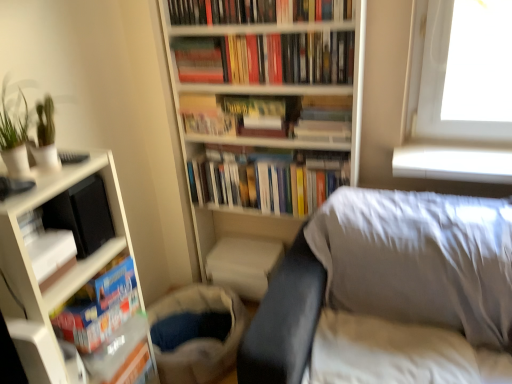
Measure the distance between hardcover books at center, which is the 5th book in bottom-to-top order, and camera.

The distance of hardcover books at center, which is the 5th book in bottom-to-top order, from camera is 5.17 feet.

Locate an element on the screen. This screenshot has width=512, height=384. hardcover book at center, which is counted as the second paperback book, starting from the right is located at coordinates (x=206, y=115).

How much space does matte brown book at center, which is the 1th paperback book from right to left, occupy horizontally?

matte brown book at center, which is the 1th paperback book from right to left, is 6.89 inches in width.

Measure the distance between point (46, 231) and camera.

→ Point (46, 231) is 4.10 feet away from camera.

What do you see at coordinates (388, 352) in the screenshot? I see `white fabric sheet at lower right` at bounding box center [388, 352].

Find the location of `matte gray bed at center`. matte gray bed at center is located at coordinates (386, 274).

Describe the element at coordinates (386, 274) in the screenshot. I see `matte gray bed at center` at that location.

Describe the element at coordinates (264, 182) in the screenshot. This screenshot has width=512, height=384. I see `hardcover books at center, the 5th book in the top-to-bottom sequence` at that location.

Where is `hardcover books at center, which is the 5th book in bottom-to-top order`? hardcover books at center, which is the 5th book in bottom-to-top order is located at coordinates (267, 58).

Is matte gray bed at center positioned beyond the bounds of hardcover books at center, the 5th book in the top-to-bottom sequence?

Yes.

Is matte gray bed at center not near hardcover books at center, the 5th book in the top-to-bottom sequence?

No, there isn't a large distance between matte gray bed at center and hardcover books at center, the 5th book in the top-to-bottom sequence.

From the image's perspective, relative to hardcover books at center, placed as the third book when sorted from bottom to top, is matte gray bed at center above or below?

Based on their image positions, matte gray bed at center is located beneath hardcover books at center, placed as the third book when sorted from bottom to top.

Can you confirm if matte gray bed at center is thinner than hardcover books at center, placed as the third book when sorted from bottom to top?

Incorrect, the width of matte gray bed at center is not less than that of hardcover books at center, placed as the third book when sorted from bottom to top.

Based on the photo, can you confirm if textured fabric bag at lower center is wider than white matte bookcase at center, which ranks as the 1th bookcase in right-to-left order?

Yes, textured fabric bag at lower center is wider than white matte bookcase at center, which ranks as the 1th bookcase in right-to-left order.

Who is smaller, textured fabric bag at lower center or white matte bookcase at center, which ranks as the 1th bookcase in right-to-left order?

textured fabric bag at lower center.

Who is more distant, textured fabric bag at lower center or white matte bookcase at center, which ranks as the 1th bookcase in right-to-left order?

textured fabric bag at lower center.

From the image's perspective, does hardcover books at center, acting as the 3th book starting from the top, appear higher than matte gray bed at center?

Yes, from the image's perspective, hardcover books at center, acting as the 3th book starting from the top, is above matte gray bed at center.

Can you tell me how much hardcover books at center, acting as the 3th book starting from the top, and matte gray bed at center differ in facing direction?

The angle between the facing direction of hardcover books at center, acting as the 3th book starting from the top, and the facing direction of matte gray bed at center is 2.44 degrees.

From a real-world perspective, relative to matte gray bed at center, is hardcover books at center, acting as the 3th book starting from the top, vertically above or below?

Clearly, from a real-world perspective, hardcover books at center, acting as the 3th book starting from the top, is above matte gray bed at center.

Which is in front, hardcover books at center, which is the 5th book in bottom-to-top order, or matte gray bed at center?

matte gray bed at center is in front.

Considering the relative sizes of hardcover books at upper center, acting as the 7th book starting from the bottom, and matte brown book at center, which is the 1th paperback book from right to left, in the image provided, is hardcover books at upper center, acting as the 7th book starting from the bottom, wider than matte brown book at center, which is the 1th paperback book from right to left,?

In fact, hardcover books at upper center, acting as the 7th book starting from the bottom, might be narrower than matte brown book at center, which is the 1th paperback book from right to left.

Would you say hardcover books at upper center, acting as the 7th book starting from the bottom, is a long distance from matte brown book at center, which is counted as the 2th paperback book, starting from the left?

hardcover books at upper center, acting as the 7th book starting from the bottom, is actually quite close to matte brown book at center, which is counted as the 2th paperback book, starting from the left.

Where is `the 2nd paperback book directly beneath the hardcover books at upper center, acting as the 7th book starting from the bottom (from a real-world perspective)`? the 2nd paperback book directly beneath the hardcover books at upper center, acting as the 7th book starting from the bottom (from a real-world perspective) is located at coordinates (263, 115).

Is hardcover books at center, which is the 5th book in bottom-to-top order, completely or partially outside of hardcover book at center, which is counted as the second paperback book, starting from the right?

Yes, hardcover books at center, which is the 5th book in bottom-to-top order, is located beyond the bounds of hardcover book at center, which is counted as the second paperback book, starting from the right.

Is hardcover books at center, acting as the 3th book starting from the top, positioned before hardcover book at center, which is counted as the second paperback book, starting from the right?

Yes.

From a real-world perspective, is hardcover books at center, which is the 5th book in bottom-to-top order, physically located above or below hardcover book at center, the 1th paperback book viewed from the left?

hardcover books at center, which is the 5th book in bottom-to-top order, is above hardcover book at center, the 1th paperback book viewed from the left.

Is hardcover book at upper center, arranged as the 2th book when viewed from the top, beside white matte bookcase at left, positioned as the 1th bookcase in left-to-right order?

They are not placed beside each other.

From a real-world perspective, relative to white matte bookcase at left, positioned as the 1th bookcase in left-to-right order, is hardcover book at upper center, arranged as the 2th book when viewed from the top, vertically above or below?

hardcover book at upper center, arranged as the 2th book when viewed from the top, is situated higher than white matte bookcase at left, positioned as the 1th bookcase in left-to-right order, in the real world.

Which is nearer, (176, 60) or (111, 169)?

The point (111, 169) is in front.

Considering the relative sizes of white matte bookcase at center, marked as the second bookcase in a left-to-right arrangement, and matte gray bed at center in the image provided, is white matte bookcase at center, marked as the second bookcase in a left-to-right arrangement, wider than matte gray bed at center?

In fact, white matte bookcase at center, marked as the second bookcase in a left-to-right arrangement, might be narrower than matte gray bed at center.

Is white matte bookcase at center, marked as the second bookcase in a left-to-right arrangement, placed right next to matte gray bed at center?

No, white matte bookcase at center, marked as the second bookcase in a left-to-right arrangement, is not beside matte gray bed at center.

From a real-world perspective, is white matte bookcase at center, which ranks as the 1th bookcase in right-to-left order, physically above matte gray bed at center?

Yes, from a real-world perspective, white matte bookcase at center, which ranks as the 1th bookcase in right-to-left order, is over matte gray bed at center

Could matte gray bed at center be considered to be inside white matte bookcase at center, marked as the second bookcase in a left-to-right arrangement?

No, white matte bookcase at center, marked as the second bookcase in a left-to-right arrangement, does not contain matte gray bed at center.

There is a matte gray bed at center. At what (x,y) coordinates should I click in order to perform the action: click on the 3rd book above it (from the image's perspective). Please return your answer as a coordinate pair (x, y). The width and height of the screenshot is (512, 384). Looking at the image, I should click on (x=264, y=182).

Where is `bookcase located on the right of textured fabric bag at lower center`? Image resolution: width=512 pixels, height=384 pixels. bookcase located on the right of textured fabric bag at lower center is located at coordinates 266,139.

From the image, which object appears to be nearer to hardcover books at center, which is the 5th book in bottom-to-top order, textured fabric bag at lower center or hardcover book at center, which is counted as the second paperback book, starting from the right?

The object closer to hardcover books at center, which is the 5th book in bottom-to-top order, is hardcover book at center, which is counted as the second paperback book, starting from the right.

Considering their positions, is white matte bookcase at center, which ranks as the 1th bookcase in right-to-left order, positioned closer to hardcover books at upper center, acting as the 7th book starting from the bottom, than white matte book at lower left, acting as the sixth book starting from the top?

Among the two, white matte bookcase at center, which ranks as the 1th bookcase in right-to-left order, is located nearer to hardcover books at upper center, acting as the 7th book starting from the bottom.

When comparing their distances from hardcover book at upper center, placed as the 6th book when sorted from bottom to top, does white fabric sheet at lower right or textured fabric bag at lower center seem closer?

A: textured fabric bag at lower center lies closer to hardcover book at upper center, placed as the 6th book when sorted from bottom to top, than the other object.

Estimate the real-world distances between objects in this image. Which object is closer to white matte book at lower left, acting as the sixth book starting from the top, matte gray bed at center or hardcover book at upper center, arranged as the 2th book when viewed from the top?

matte gray bed at center.

Estimate the real-world distances between objects in this image. Which object is closer to hardcover book at upper center, placed as the 6th book when sorted from bottom to top, textured fabric bag at lower center or white matte bookcase at center, marked as the second bookcase in a left-to-right arrangement?

white matte bookcase at center, marked as the second bookcase in a left-to-right arrangement, lies closer to hardcover book at upper center, placed as the 6th book when sorted from bottom to top, than the other object.

Looking at the image, which one is located closer to white matte book at lower left, acting as the sixth book starting from the top, hardcover books at center, acting as the 3th book starting from the top, or hardcover book at center, which is counted as the fourth book, starting from the top?

Among the two, hardcover books at center, acting as the 3th book starting from the top, is located nearer to white matte book at lower left, acting as the sixth book starting from the top.

Which object lies nearer to the anchor point white matte bookcase at left, positioned as the 1th bookcase in left-to-right order, white matte bookcase at center, which ranks as the 1th bookcase in right-to-left order, or matte gray bed at center?

Based on the image, matte gray bed at center appears to be nearer to white matte bookcase at left, positioned as the 1th bookcase in left-to-right order.

Estimate the real-world distances between objects in this image. Which object is further from white matte bookcase at center, which ranks as the 1th bookcase in right-to-left order, white matte bookcase at left, positioned as the 1th bookcase in left-to-right order, or textured fabric bag at lower center?

Among the two, white matte bookcase at left, positioned as the 1th bookcase in left-to-right order, is located further to white matte bookcase at center, which ranks as the 1th bookcase in right-to-left order.

The image size is (512, 384). In order to click on sheet that lies between hardcover book at upper center, arranged as the 2th book when viewed from the top, and textured fabric bag at lower center from top to bottom in this screenshot , I will do `click(388, 352)`.

The image size is (512, 384). In order to click on paperback book between white matte book at lower left, which ranks as the 2th book in bottom-to-top order, and hardcover book at center, which is counted as the second paperback book, starting from the right, in the front-back direction in this screenshot , I will do `click(263, 115)`.

Locate an element on the screen. The image size is (512, 384). book between hardcover books at center, which is the 5th book in bottom-to-top order, and hardcover books at center, the 5th book in the top-to-bottom sequence, in the up-down direction is located at coordinates (325, 118).

This screenshot has height=384, width=512. I want to click on gray positioned between matte gray bed at center and matte brown book at center, which is counted as the 2th paperback book, starting from the left, from near to far, so click(199, 338).